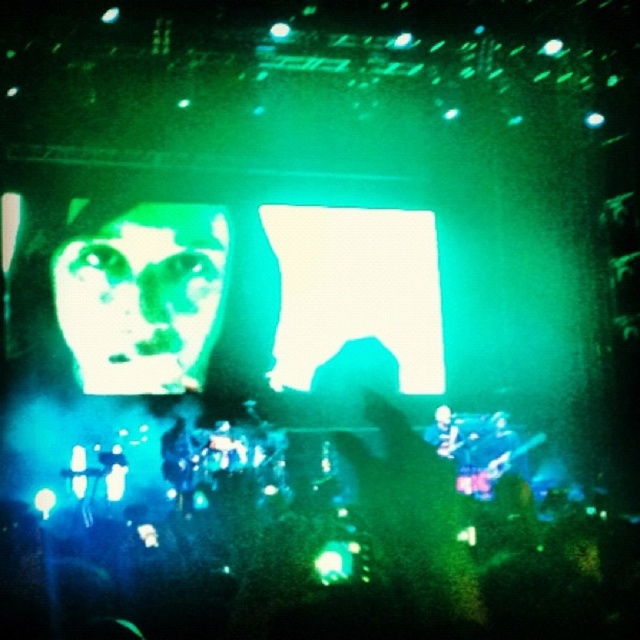
Question: In this image, where is green matte face at center located relative to white matte face at center?

Choices:
 (A) below
 (B) above

Answer: (B)

Question: Is green matte face at center to the left of white matte face at center from the viewer's perspective?

Choices:
 (A) no
 (B) yes

Answer: (B)

Question: Does green matte face at center have a lesser width compared to white matte face at center?

Choices:
 (A) yes
 (B) no

Answer: (B)